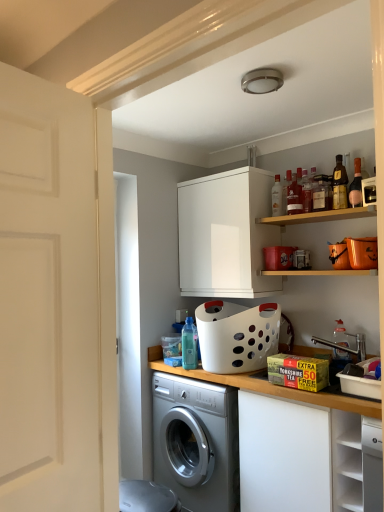
Describe the element at coordinates (356, 185) in the screenshot. I see `pink glass bottle at upper right, acting as the first bottle starting from the right` at that location.

From the picture: Measure the distance between point (289, 181) and camera.

Point (289, 181) is 2.53 meters from camera.

Find the location of a particular element. The image size is (384, 512). wooden shelf at upper right is located at coordinates (319, 216).

What do you see at coordinates (237, 336) in the screenshot? The image size is (384, 512). I see `white plastic basket at center` at bounding box center [237, 336].

The height and width of the screenshot is (512, 384). I want to click on pink glass bottle at upper right, which is the 7th bottle in left-to-right order, so click(x=356, y=185).

From the white plastic basket at center, count 4th bottle to the right and point to it. Please provide its 2D coordinates.

[(306, 192)]

Does white plastic basket at center touch translucent glass bottle at upper right, which is the fifth bottle in left-to-right order?

No, white plastic basket at center is not in contact with translucent glass bottle at upper right, which is the fifth bottle in left-to-right order.

Is white plastic basket at center in front of translucent glass bottle at upper right, placed as the 3th bottle when sorted from right to left?

Yes.

Is white plastic basket at center situated inside translucent glass bottle at upper right, placed as the 3th bottle when sorted from right to left, or outside?

white plastic basket at center is located beyond the bounds of translucent glass bottle at upper right, placed as the 3th bottle when sorted from right to left.

Is white matte cabinet at lower right, the 1th cabinetry in the bottom-to-top sequence, facing away from translucent glass bottle at upper center, marked as the 5th bottle in a right-to-left arrangement?

No, white matte cabinet at lower right, the 1th cabinetry in the bottom-to-top sequence,'s orientation is not away from translucent glass bottle at upper center, marked as the 5th bottle in a right-to-left arrangement.

What's the angular difference between white matte cabinet at lower right, acting as the 2th cabinetry starting from the top, and translucent glass bottle at upper center, marked as the 5th bottle in a right-to-left arrangement,'s facing directions?

The angular difference between white matte cabinet at lower right, acting as the 2th cabinetry starting from the top, and translucent glass bottle at upper center, marked as the 5th bottle in a right-to-left arrangement, is 2.69 degrees.

From a real-world perspective, relative to translucent glass bottle at upper center, positioned as the 3th bottle in left-to-right order, is white matte cabinet at lower right, placed as the 2th cabinetry when sorted from back to front, vertically above or below?

In terms of real-world spatial position, white matte cabinet at lower right, placed as the 2th cabinetry when sorted from back to front, is below translucent glass bottle at upper center, positioned as the 3th bottle in left-to-right order.

Is white matte cabinet at lower right, the 1th cabinetry in the bottom-to-top sequence, inside the boundaries of translucent glass bottle at upper center, positioned as the 3th bottle in left-to-right order, or outside?

white matte cabinet at lower right, the 1th cabinetry in the bottom-to-top sequence, is spatially situated outside translucent glass bottle at upper center, positioned as the 3th bottle in left-to-right order.

From the image's perspective, is translucent plastic bottle at center, which is the 7th bottle in right-to-left order, positioned above or below white plastic basket at center?

From the image's perspective, translucent plastic bottle at center, which is the 7th bottle in right-to-left order, appears above white plastic basket at center.

Is white plastic basket at center located within translucent plastic bottle at center, which is the 7th bottle in right-to-left order?

No, white plastic basket at center is not surrounded by translucent plastic bottle at center, which is the 7th bottle in right-to-left order.

Considering the sizes of objects translucent plastic bottle at center, which is the 7th bottle in right-to-left order, and white plastic basket at center in the image provided, who is taller, translucent plastic bottle at center, which is the 7th bottle in right-to-left order, or white plastic basket at center?

With more height is translucent plastic bottle at center, which is the 7th bottle in right-to-left order.

Can you confirm if translucent plastic bottle at center, which is the 7th bottle in right-to-left order, is positioned to the left of white plastic basket at center?

Yes, translucent plastic bottle at center, which is the 7th bottle in right-to-left order, is to the left of white plastic basket at center.

Is point (318, 216) closer or farther from the camera than point (264, 426)?

Point (318, 216) is positioned farther from the camera compared to point (264, 426).

Which of these two, wooden shelf at upper right or wooden countertop at lower center, is bigger?

With larger size is wooden countertop at lower center.

Considering the sizes of objects wooden shelf at upper right and wooden countertop at lower center in the image provided, who is thinner, wooden shelf at upper right or wooden countertop at lower center?

wooden shelf at upper right is thinner.

Does wooden shelf at upper right lie in front of wooden countertop at lower center?

That is False.

Which object is closer to the camera taking this photo, translucent glass bottle at upper right, which is the fifth bottle in left-to-right order, or translucent plastic bottle at upper center, which is counted as the 6th bottle, starting from the right?

Positioned in front is translucent glass bottle at upper right, which is the fifth bottle in left-to-right order.

There is a translucent glass bottle at upper right, which is the fifth bottle in left-to-right order. Identify the location of the 3rd bottle below it (from a real-world perspective). (277, 197).

Could you tell me if translucent glass bottle at upper right, placed as the 3th bottle when sorted from right to left, is turned towards translucent plastic bottle at upper center, which is counted as the 6th bottle, starting from the right?

No, translucent glass bottle at upper right, placed as the 3th bottle when sorted from right to left, is not oriented towards translucent plastic bottle at upper center, which is counted as the 6th bottle, starting from the right.

From a real-world perspective, is translucent plastic bottle at center, the first bottle from the left, on white matte cabinet at lower right, the first cabinetry from the front?

Indeed, from a real-world perspective, translucent plastic bottle at center, the first bottle from the left, stands above white matte cabinet at lower right, the first cabinetry from the front.

Can white matte cabinet at lower right, placed as the 2th cabinetry when sorted from back to front, be found inside translucent plastic bottle at center, the first bottle from the left?

No.

Which point is more distant from viewer, (196,362) or (347,487)?

Positioned behind is point (196,362).

Is translucent plastic bottle at center, the first bottle from the left, taller than white matte cabinet at lower right, the first cabinetry from the front?

No, translucent plastic bottle at center, the first bottle from the left, is not taller than white matte cabinet at lower right, the first cabinetry from the front.

From the image's perspective, is white matte cabinet at lower right, the first cabinetry from the front, under translucent plastic bottle at upper center, which is counted as the 6th bottle, starting from the right?

Correct, white matte cabinet at lower right, the first cabinetry from the front, appears lower than translucent plastic bottle at upper center, which is counted as the 6th bottle, starting from the right, in the image.

From a real-world perspective, is white matte cabinet at lower right, acting as the 2th cabinetry starting from the top, beneath translucent plastic bottle at upper center, which is counted as the 6th bottle, starting from the right?

Yes, from a real-world perspective, white matte cabinet at lower right, acting as the 2th cabinetry starting from the top, is under translucent plastic bottle at upper center, which is counted as the 6th bottle, starting from the right.

Does point (337, 451) lie in front of point (279, 191)?

Yes, it is.

Considering the sizes of objects white matte cabinet at lower right, acting as the 2th cabinetry starting from the top, and translucent plastic bottle at upper center, which is counted as the 6th bottle, starting from the right, in the image provided, who is smaller, white matte cabinet at lower right, acting as the 2th cabinetry starting from the top, or translucent plastic bottle at upper center, which is counted as the 6th bottle, starting from the right,?

Smaller between the two is translucent plastic bottle at upper center, which is counted as the 6th bottle, starting from the right.

Find the location of a particular element. Image resolution: width=384 pixels, height=512 pixels. the 4th bottle to the right of the white plastic basket at center, counting from the anchor's position is located at coordinates (306, 192).

Where is `cabinetry in front of the translucent glass bottle at upper center, positioned as the 3th bottle in left-to-right order`? cabinetry in front of the translucent glass bottle at upper center, positioned as the 3th bottle in left-to-right order is located at coordinates (356, 462).

Looking at the image, which one is located further to white plastic basket at center, wooden countertop at lower center or translucent glass bottle at upper right, which is the fifth bottle in left-to-right order?

translucent glass bottle at upper right, which is the fifth bottle in left-to-right order, is further to white plastic basket at center.

Considering their positions, is white plastic basket at center positioned further to shiny brown bottle at upper right, arranged as the 6th bottle when viewed from the left, than translucent plastic bottle at upper center, which is counted as the 6th bottle, starting from the right?

white plastic basket at center is further to shiny brown bottle at upper right, arranged as the 6th bottle when viewed from the left.

Looking at the image, which one is located further to white matte door at left, translucent glass bottle at upper right, which is the fifth bottle in left-to-right order, or translucent plastic bottle at upper center, which is counted as the 6th bottle, starting from the right?

Among the two, translucent glass bottle at upper right, which is the fifth bottle in left-to-right order, is located further to white matte door at left.

Estimate the real-world distances between objects in this image. Which object is closer to white matte cabinet at upper center, marked as the 1th cabinetry in a top-to-bottom arrangement, translucent glass bottle at upper center, positioned as the 3th bottle in left-to-right order, or translucent plastic bottle at center, the first bottle from the left?

translucent glass bottle at upper center, positioned as the 3th bottle in left-to-right order, is closer to white matte cabinet at upper center, marked as the 1th cabinetry in a top-to-bottom arrangement.

Which object lies further to the anchor point wooden shelf at upper right, translucent plastic bottle at center, the first bottle from the left, or white plastic basket at center?

Among the two, translucent plastic bottle at center, the first bottle from the left, is located further to wooden shelf at upper right.

From the picture: From the image, which object appears to be farther from white matte cabinet at upper center, the first cabinetry when ordered from left to right, shiny brown bottle at upper right, arranged as the 6th bottle when viewed from the left, or white plastic basket at center?

shiny brown bottle at upper right, arranged as the 6th bottle when viewed from the left.

Which object lies further to the anchor point white plastic basket at center, translucent plastic bottle at center, the first bottle from the left, or white matte cabinet at upper center, marked as the 1th cabinetry in a top-to-bottom arrangement?

Based on the image, white matte cabinet at upper center, marked as the 1th cabinetry in a top-to-bottom arrangement, appears to be further to white plastic basket at center.

Estimate the real-world distances between objects in this image. Which object is closer to white matte cabinet at upper center, the second cabinetry when ordered from front to back, translucent glass bottle at upper center, acting as the 4th bottle starting from the left, or wooden countertop at lower center?

translucent glass bottle at upper center, acting as the 4th bottle starting from the left, is positioned closer to the anchor white matte cabinet at upper center, the second cabinetry when ordered from front to back.

Locate an element on the screen. basket between white matte door at left and translucent glass bottle at upper center, marked as the 5th bottle in a right-to-left arrangement, from front to back is located at coordinates (237, 336).

This screenshot has width=384, height=512. Identify the location of shelf between translucent plastic bottle at upper center, which is the second bottle from left to right, and wooden countertop at lower center from top to bottom. (319, 216).

This screenshot has width=384, height=512. I want to click on bottle that lies between translucent glass bottle at upper center, placed as the 4th bottle when sorted from right to left, and white plastic basket at center from top to bottom, so click(189, 345).

At what (x,y) coordinates should I click in order to perform the action: click on cabinetry between white matte door at left and translucent glass bottle at upper center, marked as the 5th bottle in a right-to-left arrangement, along the z-axis. Please return your answer as a coordinate pair (x, y). Image resolution: width=384 pixels, height=512 pixels. Looking at the image, I should click on (x=356, y=462).